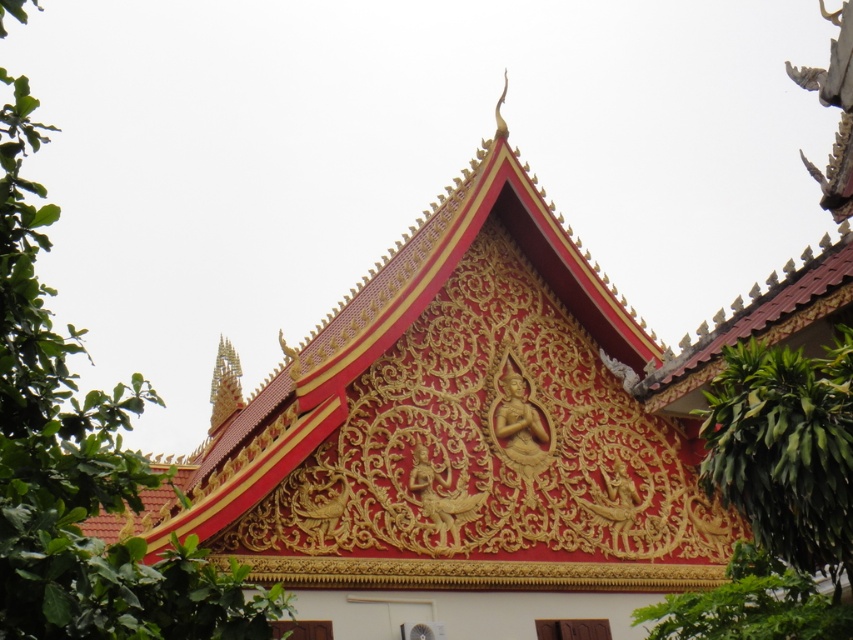
Question: Is green leafy tree at left to the right of green leafy tree at right from the viewer's perspective?

Choices:
 (A) yes
 (B) no

Answer: (B)

Question: Among these points, which one is nearest to the camera?

Choices:
 (A) 825,468
 (B) 192,580

Answer: (B)

Question: In this image, where is green leafy tree at left located relative to green leafy tree at right?

Choices:
 (A) right
 (B) left

Answer: (B)

Question: Which object is farther from the camera taking this photo?

Choices:
 (A) green leafy tree at left
 (B) green leafy tree at right

Answer: (B)

Question: Is green leafy tree at left behind green leafy tree at right?

Choices:
 (A) yes
 (B) no

Answer: (B)